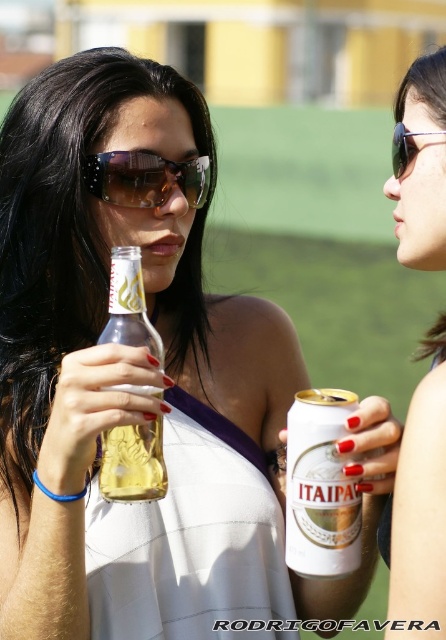
Question: Where is gold metallic can at center located in relation to translucent glass bottle at center in the image?

Choices:
 (A) below
 (B) above

Answer: (A)

Question: Can you confirm if matte black sunglasses at upper right is positioned to the left of gold metallic can at center?

Choices:
 (A) yes
 (B) no

Answer: (B)

Question: Which of the following is the farthest from the observer?

Choices:
 (A) translucent glass bottle at center
 (B) sunglasses at upper right
 (C) gold metallic can at center

Answer: (A)

Question: Estimate the real-world distances between objects in this image. Which object is farther from the matte black sunglasses at upper right?

Choices:
 (A) gold metallic can at center
 (B) brown reflective sunglasses at center
 (C) translucent glass bottle at center
 (D) sunglasses at upper right

Answer: (B)

Question: Is gold metallic can at center above sunglasses at upper right?

Choices:
 (A) yes
 (B) no

Answer: (B)

Question: Among these objects, which one is farthest from the camera?

Choices:
 (A) brown reflective sunglasses at center
 (B) gold metallic can at center
 (C) sunglasses at upper right
 (D) matte black sunglasses at upper right

Answer: (A)